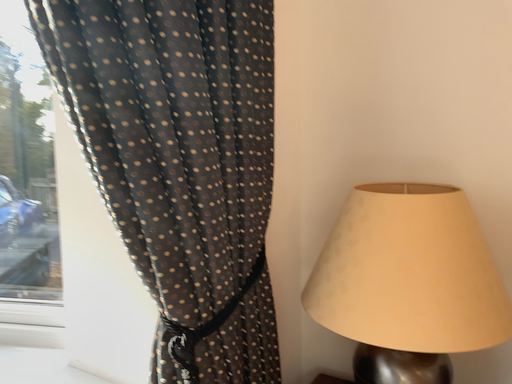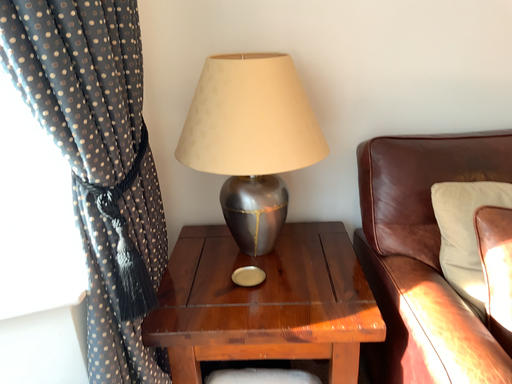
Question: How did the camera likely rotate when shooting the video?

Choices:
 (A) rotated downward
 (B) rotated upward

Answer: (A)